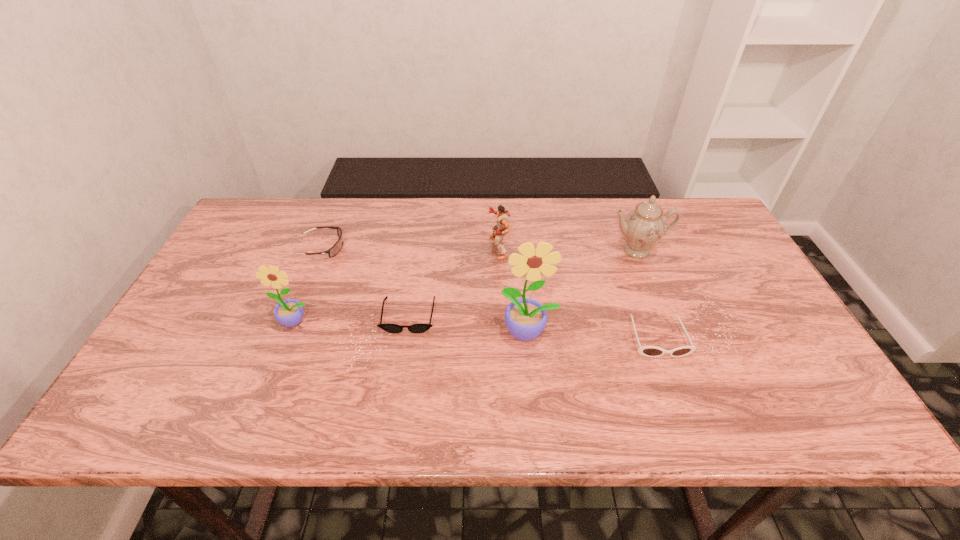
This screenshot has height=540, width=960. I want to click on free space between the puncher and the shortest object, so click(453, 282).

You are a GUI agent. You are given a task and a screenshot of the screen. Output one action in this format:
    pyautogui.click(x=<x>, y=<y>)
    Task: Click on the free area in between the taller sunglasses and the goggles
    
    Given the screenshot: What is the action you would take?
    pyautogui.click(x=490, y=292)

The width and height of the screenshot is (960, 540). I want to click on vacant space in between the shorter sunflower and the chinaware, so click(466, 286).

Locate an element on the screen. The width and height of the screenshot is (960, 540). vacant space in between the shorter sunflower and the goggles is located at coordinates (309, 285).

Find the location of a particular element. vacant area between the taller sunflower and the goggles is located at coordinates (425, 290).

At what (x,y) coordinates should I click in order to perform the action: click on the closest object to the taller sunflower. Please return your answer as a coordinate pair (x, y). The image size is (960, 540). Looking at the image, I should click on (388, 327).

Identify which object is the closest to the goggles. Please provide its 2D coordinates. Your answer should be formatted as a tuple, i.e. [(x, y)], where the tuple contains the x and y coordinates of a point satisfying the conditions above.

[(289, 313)]